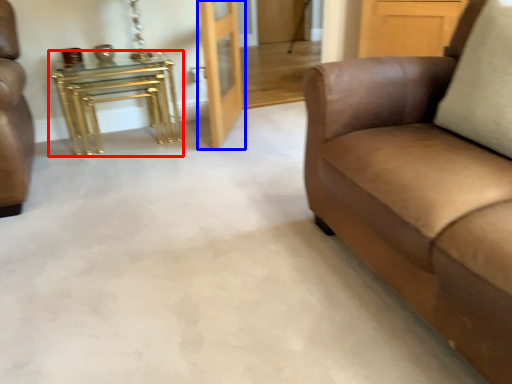
Question: Which point is further to the camera, table (highlighted by a red box) or door (highlighted by a blue box)?

Choices:
 (A) table
 (B) door

Answer: (A)